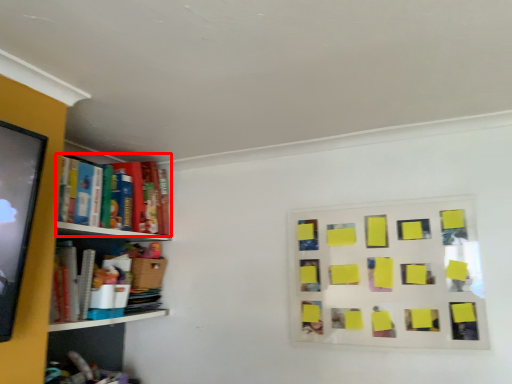
Question: Observing the image, what is the correct spatial positioning of book (annotated by the red box) in reference to bulletin board?

Choices:
 (A) right
 (B) left

Answer: (B)